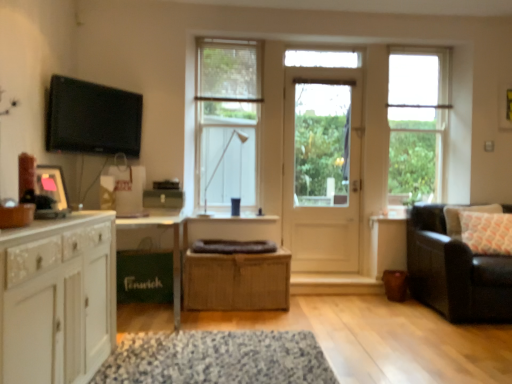
Find the location of a particular element. free space in front of bamboo cabinet at center, acting as the first cabinetry starting from the back is located at coordinates pos(236,323).